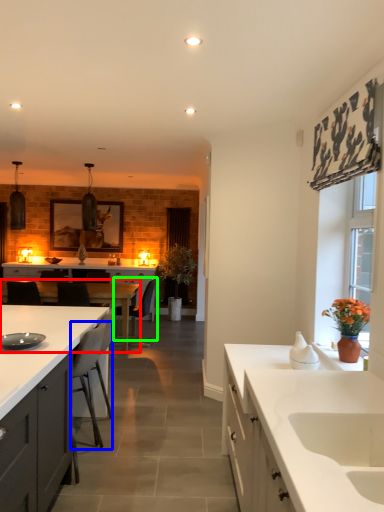
Question: Considering the real-world distances, which object is farthest from table (highlighted by a red box)? chair (highlighted by a blue box) or chair (highlighted by a green box)?

Choices:
 (A) chair
 (B) chair

Answer: (A)